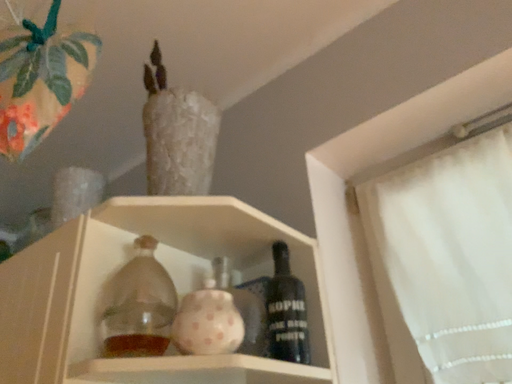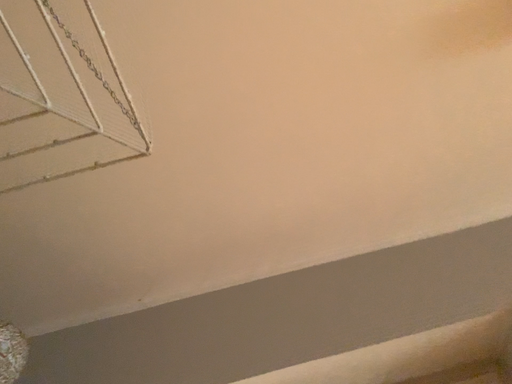
Question: Which way did the camera rotate in the video?

Choices:
 (A) rotated right
 (B) rotated left

Answer: (A)